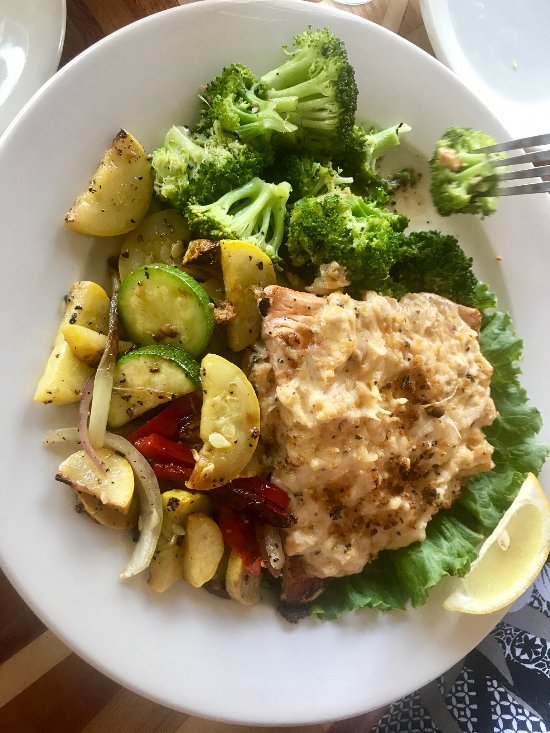
Where is `white plate`? Image resolution: width=550 pixels, height=733 pixels. white plate is located at coordinates (174, 66).